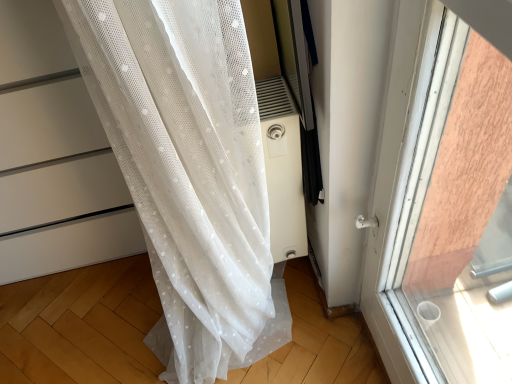
What do you see at coordinates (58, 178) in the screenshot?
I see `white sheer curtain at left` at bounding box center [58, 178].

In order to click on white sheer curtain at left in this screenshot , I will do `click(58, 178)`.

Identify the location of white sheer curtain at left. The width and height of the screenshot is (512, 384). (58, 178).